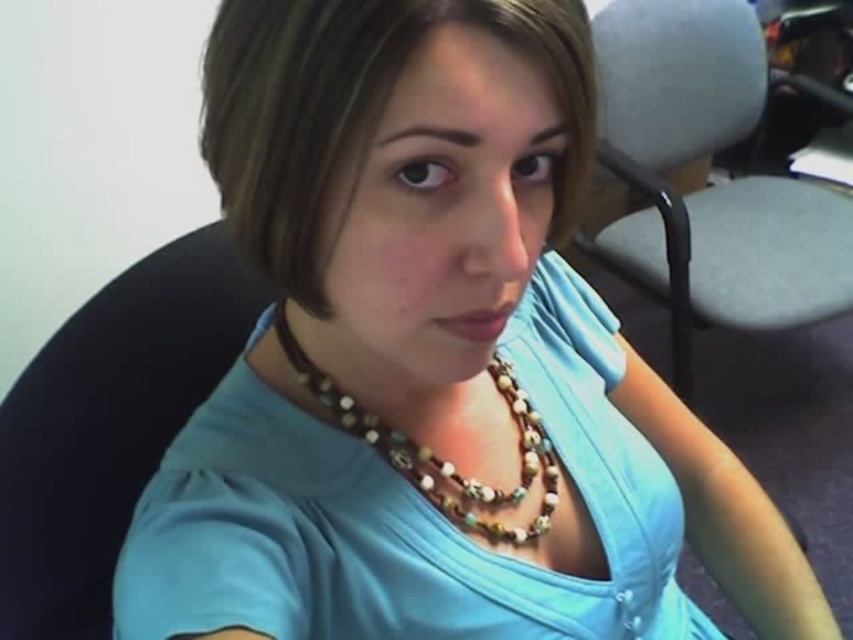
Is gray fabric swivel chair at right closer to the viewer compared to brown beaded necklace at center?

No.

Which of these two, gray fabric swivel chair at right or brown beaded necklace at center, stands taller?

With more height is gray fabric swivel chair at right.

Locate an element on the screen. The width and height of the screenshot is (853, 640). gray fabric swivel chair at right is located at coordinates (712, 186).

Locate an element on the screen. The width and height of the screenshot is (853, 640). gray fabric swivel chair at right is located at coordinates [712, 186].